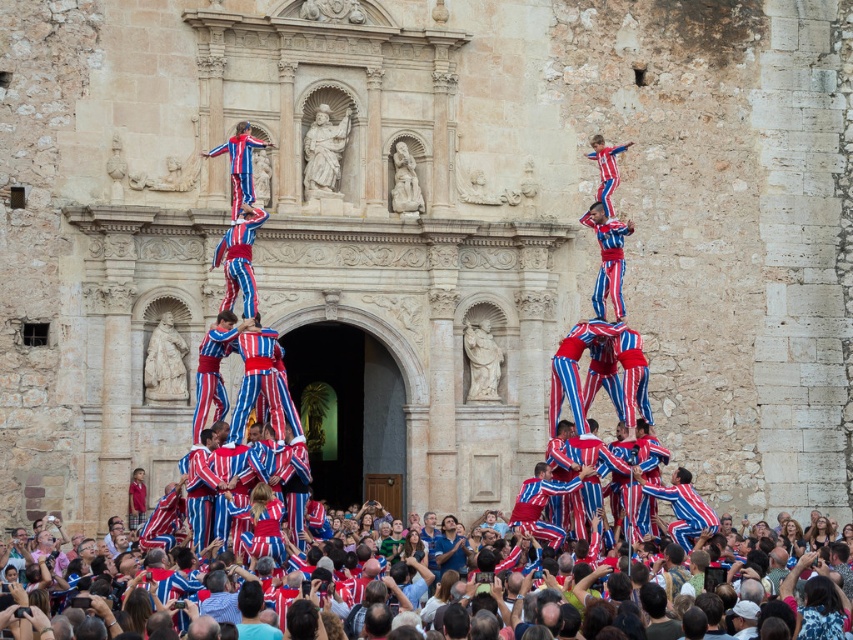
You are attending the cultural event in front of the historic stone building. You notice the matte red fabric at lower center and the matte red and blue striped pants at center. Which object is positioned lower in the scene?

The matte red fabric at lower center is positioned lower than the matte red and blue striped pants at center.

You are standing in front of the historic stone building and want to take a photo of the point at coordinates (798, 564). If your camera can focus on objects up to 60 meters away, will it be able to capture the point clearly?

The distance of point (798, 564) from the camera is 63.32 meters, which is beyond the camera focus range of 60 meters. Therefore, the camera cannot capture the point clearly.

You are a photographer standing in front of the historic stone building. You want to take a photo of the castell human pyramid. Which object, the matte red fabric at lower center or the matte red and blue striped pants at center, will appear closer to you in the photo?

The matte red fabric at lower center will appear closer to you in the photo because it is in front of the matte red and blue striped pants at center.